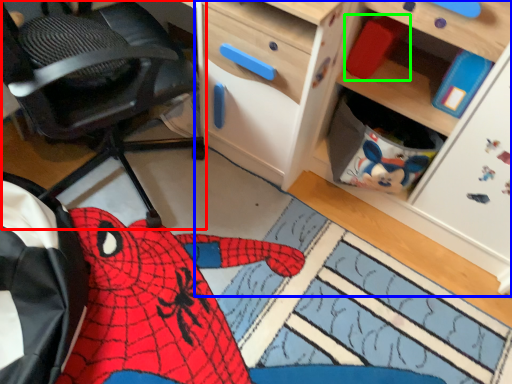
Question: Considering the real-world distances, which object is closest to chair (highlighted by a red box)? cabinetry (highlighted by a blue box) or toy (highlighted by a green box).

Choices:
 (A) cabinetry
 (B) toy

Answer: (A)